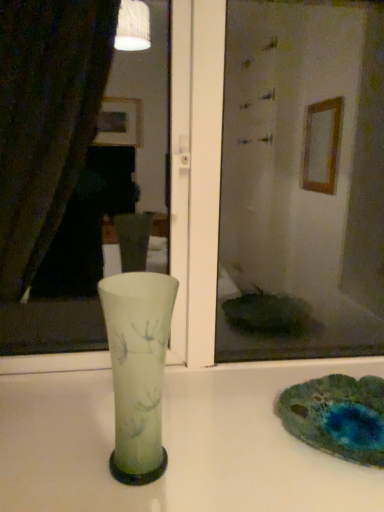
The height and width of the screenshot is (512, 384). Find the location of `vacant region to the right of frosted glass vase at center`. vacant region to the right of frosted glass vase at center is located at coordinates (221, 466).